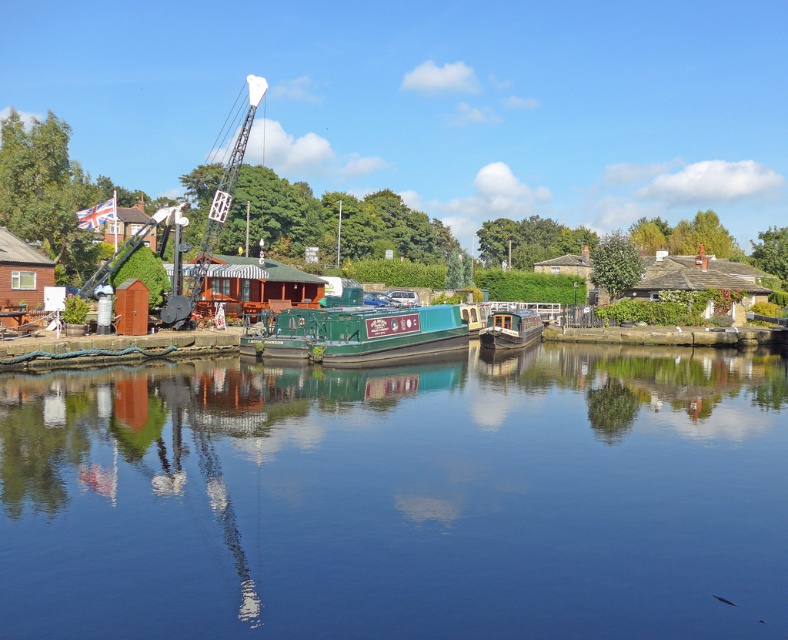
You are standing at the riverside and want to take a photo. There are two points marked in the image at coordinates point (277, 337) and point (519, 333). Which point will appear larger in your photo?

Point (277, 337) is closer to the camera than point (519, 333), so it will appear larger in the photo.

You are standing on the riverside and want to take a photo of the smooth blue water at center and the metallic industrial crane at center. Where should you position yourself to ensure both are in the frame?

You should position yourself at a viewpoint where the smooth blue water at center is directly below the metallic industrial crane at center, as the smooth blue water at center is positioned under the metallic industrial crane at center.

You are planning to dock a small boat that requires a 10 meters wide space. You see the smooth blue water at center and the metallic industrial crane at center. Which location has enough width for your boat?

The metallic industrial crane at center has a width greater than the smooth blue water at center, so you should choose the metallic industrial crane at center location for docking your boat since it provides sufficient width.